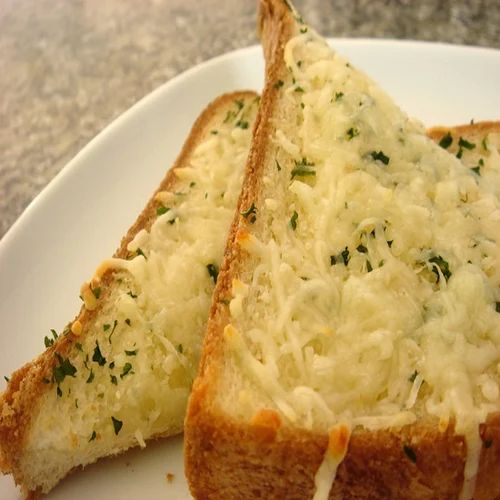
At what (x,y) coordinates should I click in order to perform the action: click on white plate. Please return your answer as a coordinate pair (x, y). The image size is (500, 500). Looking at the image, I should click on (87, 213).